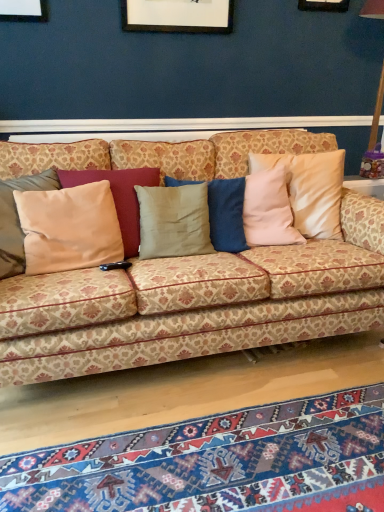
Question: Is textured wool mat at lower center taller than patterned fabric couch at center?

Choices:
 (A) yes
 (B) no

Answer: (B)

Question: From the image's perspective, is textured wool mat at lower center over patterned fabric couch at center?

Choices:
 (A) yes
 (B) no

Answer: (B)

Question: Considering the relative positions of textured wool mat at lower center and patterned fabric couch at center in the image provided, is textured wool mat at lower center behind patterned fabric couch at center?

Choices:
 (A) yes
 (B) no

Answer: (B)

Question: Is textured wool mat at lower center oriented away from patterned fabric couch at center?

Choices:
 (A) no
 (B) yes

Answer: (A)

Question: Is textured wool mat at lower center to the left of patterned fabric couch at center from the viewer's perspective?

Choices:
 (A) no
 (B) yes

Answer: (A)

Question: Is textured wool mat at lower center bigger than patterned fabric couch at center?

Choices:
 (A) yes
 (B) no

Answer: (B)

Question: Can you confirm if patterned fabric couch at center is positioned to the right of textured wool mat at lower center?

Choices:
 (A) yes
 (B) no

Answer: (B)

Question: Considering the relative positions of patterned fabric couch at center and textured wool mat at lower center in the image provided, is patterned fabric couch at center in front of textured wool mat at lower center?

Choices:
 (A) no
 (B) yes

Answer: (A)

Question: From the image's perspective, is patterned fabric couch at center over textured wool mat at lower center?

Choices:
 (A) no
 (B) yes

Answer: (B)

Question: Does patterned fabric couch at center touch textured wool mat at lower center?

Choices:
 (A) yes
 (B) no

Answer: (B)

Question: Considering the relative sizes of patterned fabric couch at center and textured wool mat at lower center in the image provided, is patterned fabric couch at center smaller than textured wool mat at lower center?

Choices:
 (A) yes
 (B) no

Answer: (B)

Question: Is the depth of patterned fabric couch at center greater than that of textured wool mat at lower center?

Choices:
 (A) yes
 (B) no

Answer: (A)

Question: From a real-world perspective, is textured wool mat at lower center physically below satin beige pillow at left?

Choices:
 (A) yes
 (B) no

Answer: (A)